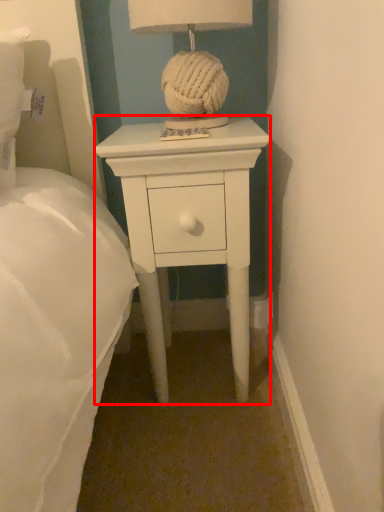
Question: From the image, what is the correct spatial relationship of nightstand (annotated by the red box) in relation to table lamp?

Choices:
 (A) left
 (B) right

Answer: (B)